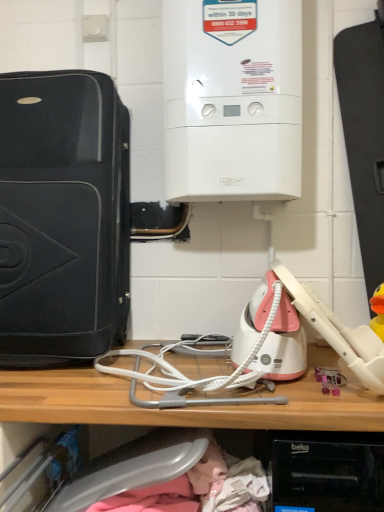
Question: Does white textured wire at center, the first wire positioned from the top, have a lesser width compared to wooden shelf at center?

Choices:
 (A) no
 (B) yes

Answer: (B)

Question: Is wooden shelf at center at the back of white textured wire at center, which is counted as the 2th wire, starting from the bottom?

Choices:
 (A) yes
 (B) no

Answer: (B)

Question: Does white textured wire at center, the first wire positioned from the top, have a larger size compared to wooden shelf at center?

Choices:
 (A) no
 (B) yes

Answer: (A)

Question: Can we say white textured wire at center, the first wire positioned from the top, lies outside wooden shelf at center?

Choices:
 (A) no
 (B) yes

Answer: (B)

Question: Can you confirm if white textured wire at center, which is counted as the 2th wire, starting from the bottom, is wider than wooden shelf at center?

Choices:
 (A) no
 (B) yes

Answer: (A)

Question: Is white textured wire at center, the first wire positioned from the top, smaller than wooden shelf at center?

Choices:
 (A) yes
 (B) no

Answer: (A)

Question: From the image's perspective, is white glossy boiler at upper center, which is counted as the first home appliance, starting from the right, over pink plastic toy at lower right?

Choices:
 (A) yes
 (B) no

Answer: (A)

Question: Does white glossy boiler at upper center, the 2th home appliance from the left, have a lesser height compared to pink plastic toy at lower right?

Choices:
 (A) no
 (B) yes

Answer: (A)

Question: Is there a large distance between white glossy boiler at upper center, which is counted as the first home appliance, starting from the right, and pink plastic toy at lower right?

Choices:
 (A) yes
 (B) no

Answer: (B)

Question: From a real-world perspective, is white glossy boiler at upper center, the 2th home appliance from the left, on top of pink plastic toy at lower right?

Choices:
 (A) no
 (B) yes

Answer: (B)

Question: From the image's perspective, would you say white glossy boiler at upper center, which is counted as the first home appliance, starting from the right, is shown under pink plastic toy at lower right?

Choices:
 (A) yes
 (B) no

Answer: (B)

Question: Can you confirm if white glossy boiler at upper center, which is counted as the first home appliance, starting from the right, is thinner than pink plastic toy at lower right?

Choices:
 (A) no
 (B) yes

Answer: (A)

Question: Is white glossy boiler at upper center, which is counted as the first home appliance, starting from the right, taller than white textured wire at center, positioned as the 1th wire in bottom-to-top order?

Choices:
 (A) yes
 (B) no

Answer: (A)